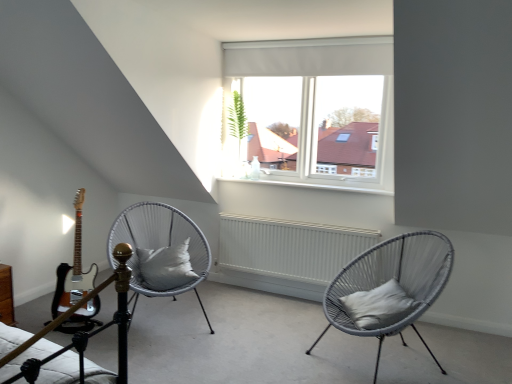
Question: Would you say white fabric pillow at center, arranged as the 2th pillow when viewed from the right, is part of white matte radiator at center's contents?

Choices:
 (A) no
 (B) yes

Answer: (A)

Question: Is white matte radiator at center to the right of white fabric pillow at center, which ranks as the first pillow in left-to-right order, from the viewer's perspective?

Choices:
 (A) yes
 (B) no

Answer: (A)

Question: From the image's perspective, is white matte radiator at center below white fabric pillow at center, placed as the second pillow when sorted from front to back?

Choices:
 (A) no
 (B) yes

Answer: (B)

Question: Is white matte radiator at center shorter than white fabric pillow at center, which ranks as the first pillow in left-to-right order?

Choices:
 (A) yes
 (B) no

Answer: (B)

Question: Is the depth of white matte radiator at center less than that of white fabric pillow at center, placed as the second pillow when sorted from front to back?

Choices:
 (A) no
 (B) yes

Answer: (A)

Question: Is white matte radiator at center to the left of white fabric pillow at center, the first pillow positioned from the back, from the viewer's perspective?

Choices:
 (A) no
 (B) yes

Answer: (A)

Question: Considering the relative positions of woven grey chair at center, the 1th chair viewed from the right, and white glossy electric guitar at left in the image provided, is woven grey chair at center, the 1th chair viewed from the right, to the right of white glossy electric guitar at left from the viewer's perspective?

Choices:
 (A) yes
 (B) no

Answer: (A)

Question: Is woven grey chair at center, the 1th chair viewed from the right, beside white glossy electric guitar at left?

Choices:
 (A) yes
 (B) no

Answer: (B)

Question: Is woven grey chair at center, the 1th chair viewed from the right, oriented away from white glossy electric guitar at left?

Choices:
 (A) yes
 (B) no

Answer: (B)

Question: Is woven grey chair at center, the second chair viewed from the left, positioned behind white glossy electric guitar at left?

Choices:
 (A) yes
 (B) no

Answer: (B)

Question: Does woven grey chair at center, the second chair viewed from the left, have a lesser width compared to white glossy electric guitar at left?

Choices:
 (A) no
 (B) yes

Answer: (A)

Question: Is woven grey chair at center, the second chair viewed from the left, surrounding white glossy electric guitar at left?

Choices:
 (A) yes
 (B) no

Answer: (B)

Question: From the image's perspective, would you say white matte radiator at center is shown under gray fabric pillow at right, placed as the 2th pillow when sorted from back to front?

Choices:
 (A) yes
 (B) no

Answer: (B)